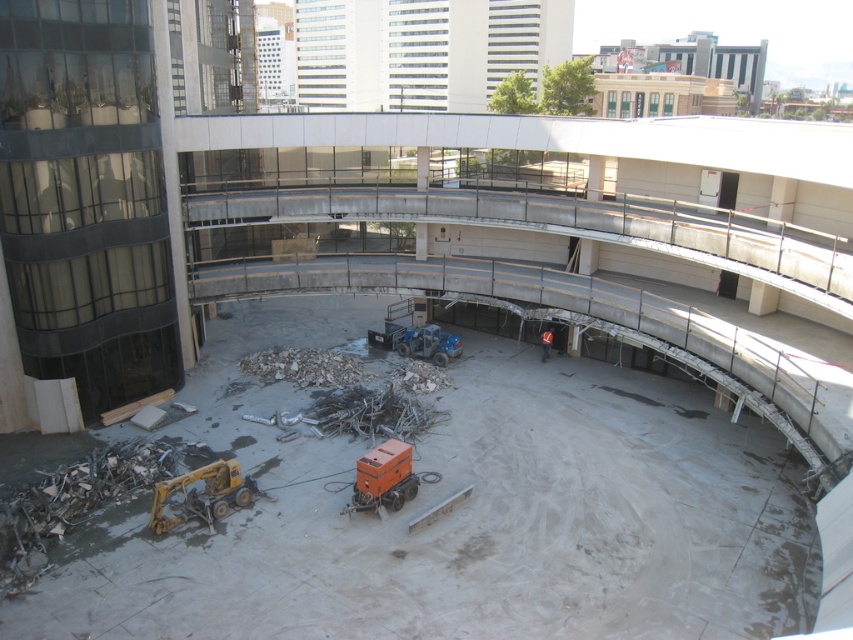
You are an inspector standing at the edge of the construction site. You need to determine if the yellow metallic excavator at lower left can be safely moved without hitting the orange reflective vest at center. Based on their heights, can the excavator be moved over the vest?

The yellow metallic excavator at lower left is taller than the orange reflective vest at center. Since the excavator is taller, it can be moved over the vest as long as there is enough vertical clearance, but the height difference alone does not guarantee safety. Other factors like the path and stability should also be considered.

In the scene shown: You are an inspector standing on the curved walkway on the right side of the image. You need to check the safety of the yellow metallic excavator at lower left and the orange reflective vest at center. From your vantage point, which object is positioned lower in the scene?

The yellow metallic excavator at lower left is located below the orange reflective vest at center, so it is positioned lower in the scene.

You are a construction worker standing at the edge of the construction site. You need to move a heavy load from the yellow metallic excavator at lower left to the orange metallic generator at center. Which direction should you move the load to reach the generator?

You should move the load to the right because the yellow metallic excavator at lower left is to the left of the orange metallic generator at center, so moving right will bring it closer to the generator.